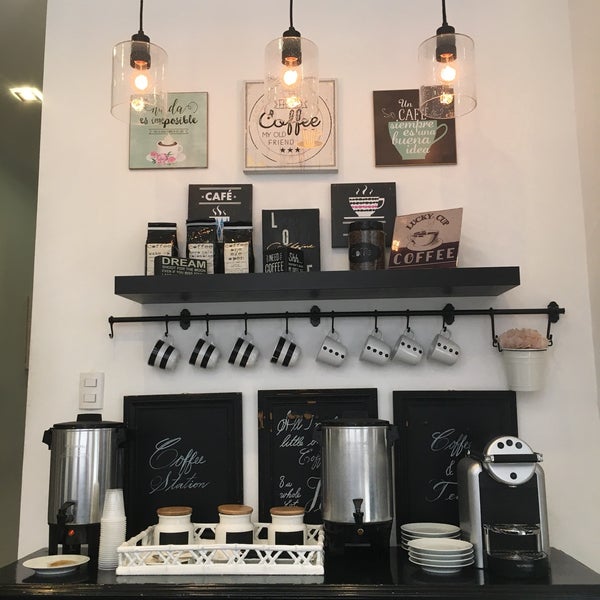
Locate an element on the screen. The height and width of the screenshot is (600, 600). black rectangular frames is located at coordinates (130, 405), (264, 400), (402, 398).